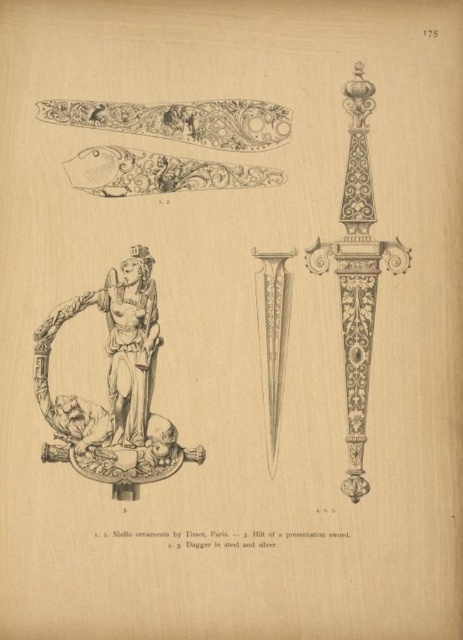
Question: Does polished bronze statue at center appear under etched silver dagger at center?

Choices:
 (A) yes
 (B) no

Answer: (A)

Question: From the image, what is the correct spatial relationship of etched silver dagger at center in relation to polished silver dagger at center?

Choices:
 (A) right
 (B) left

Answer: (A)

Question: Which of these objects is positioned farthest from the etched silver dagger at center?

Choices:
 (A) polished bronze statue at center
 (B) polished silver dagger at center

Answer: (A)

Question: Which is farther from the polished bronze statue at center?

Choices:
 (A) polished silver dagger at center
 (B) etched silver dagger at center

Answer: (B)

Question: Which point is farther to the camera?

Choices:
 (A) polished silver dagger at center
 (B) polished bronze statue at center

Answer: (A)

Question: Can you confirm if etched silver dagger at center is wider than polished silver dagger at center?

Choices:
 (A) no
 (B) yes

Answer: (B)